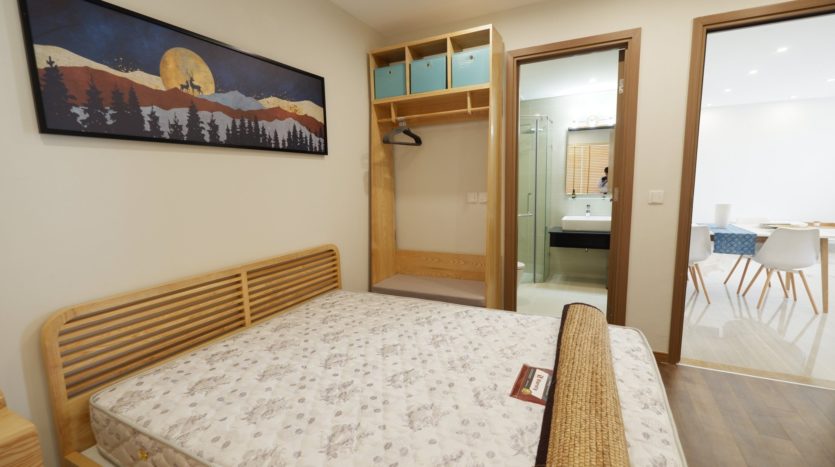
Locate an element on the screen. wall art is located at coordinates (204, 107).